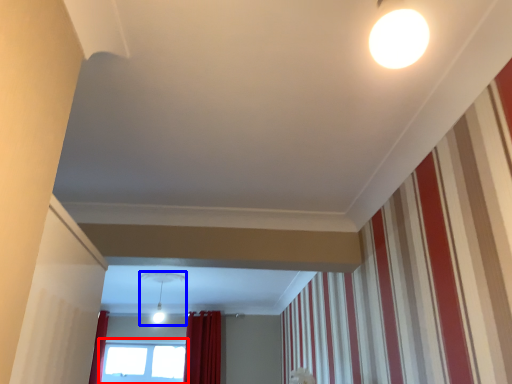
Question: Which object appears closest to the camera in this image, window (highlighted by a red box) or light fixture (highlighted by a blue box)?

Choices:
 (A) window
 (B) light fixture

Answer: (B)